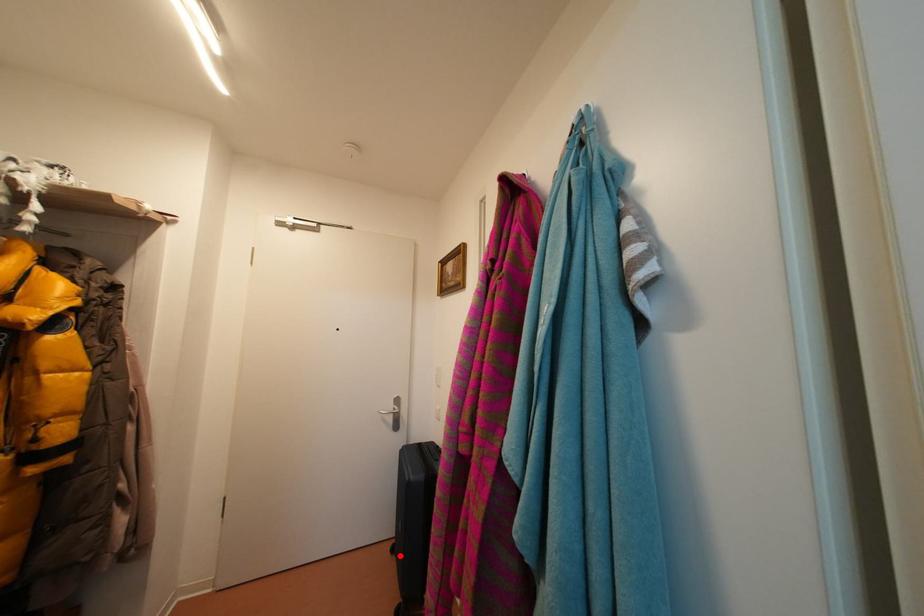
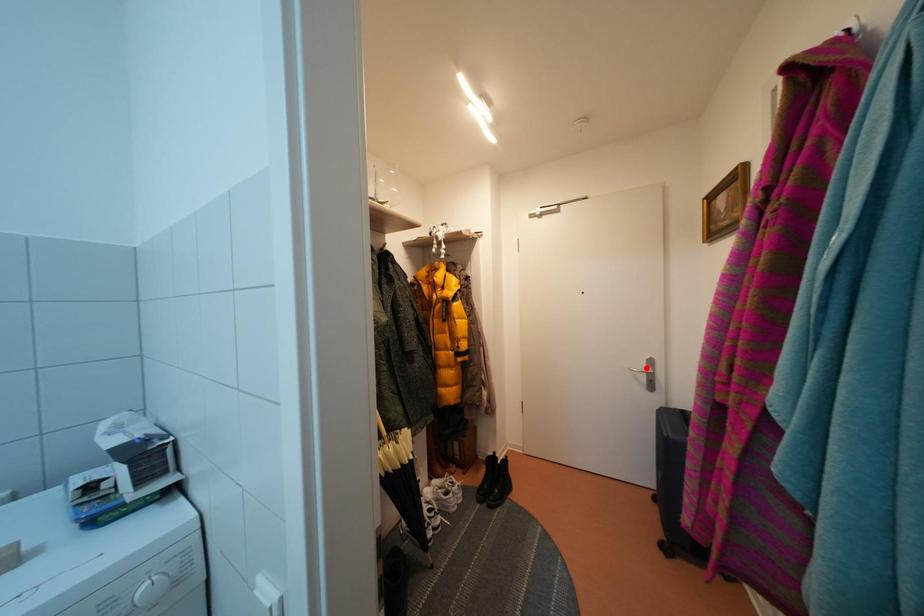
I am providing you with two images of the same scene from different viewpoints. A red point is marked on the first image and another point is marked on the second image. Is the red point in image1 aligned with the point shown in image2?

No